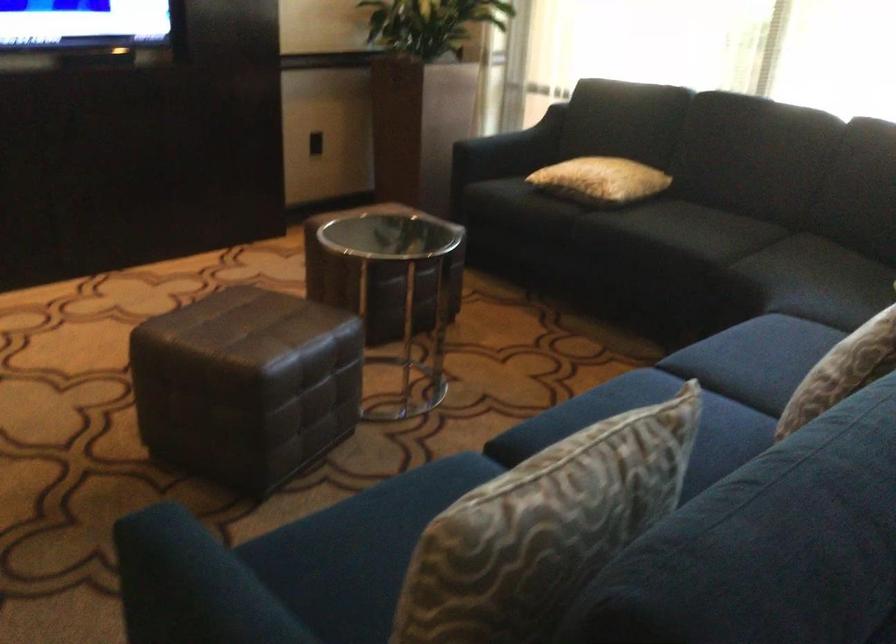
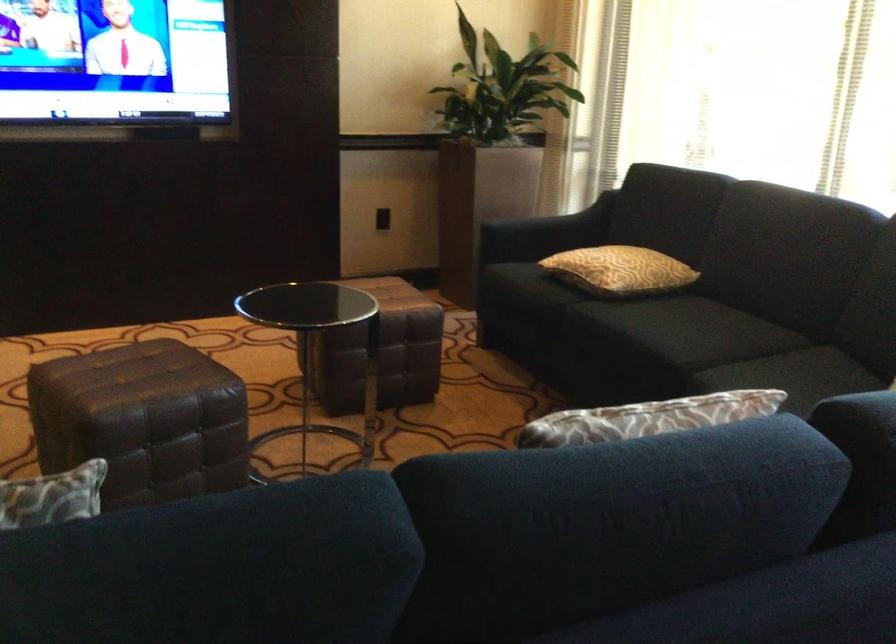
Question: The images are taken continuously from a first-person perspective. In which direction are you moving?

Choices:
 (A) Left
 (B) Right
 (C) Forward
 (D) Backward

Answer: (B)